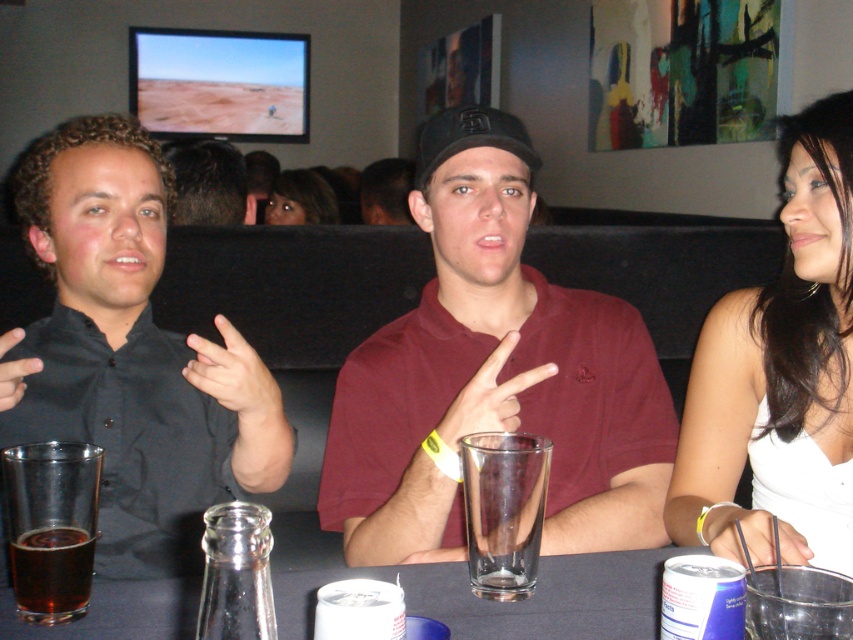
Between white satin dress at right and blonde hair at center, which one has less height?

blonde hair at center

The height and width of the screenshot is (640, 853). I want to click on white satin dress at right, so click(x=780, y=374).

Which is behind, point (825, 243) or point (300, 182)?

The point (300, 182) is behind.

The image size is (853, 640). I want to click on white satin dress at right, so click(x=780, y=374).

Which is more to the right, dark amber glass at lower left or blonde hair at center?

dark amber glass at lower left is more to the right.

Describe the element at coordinates (51, 525) in the screenshot. Image resolution: width=853 pixels, height=640 pixels. I see `dark amber glass at lower left` at that location.

Which is in front, point (57, 468) or point (300, 216)?

Point (57, 468) is more forward.

Where is `dark amber glass at lower left`? Image resolution: width=853 pixels, height=640 pixels. dark amber glass at lower left is located at coordinates (51, 525).

Between dark gray shirt at left and dark amber glass at lower left, which one is positioned lower?

dark amber glass at lower left is below.

Is point (161, 170) closer to viewer compared to point (96, 536)?

No.

Which is in front, point (18, 202) or point (54, 532)?

Point (54, 532) is more forward.

Identify the location of dark gray shirt at left. The height and width of the screenshot is (640, 853). (131, 353).